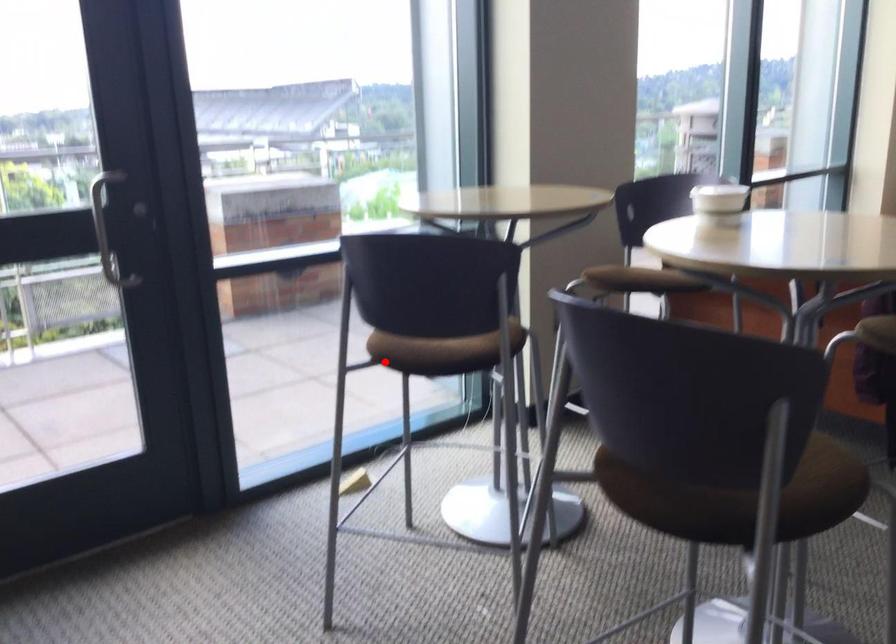
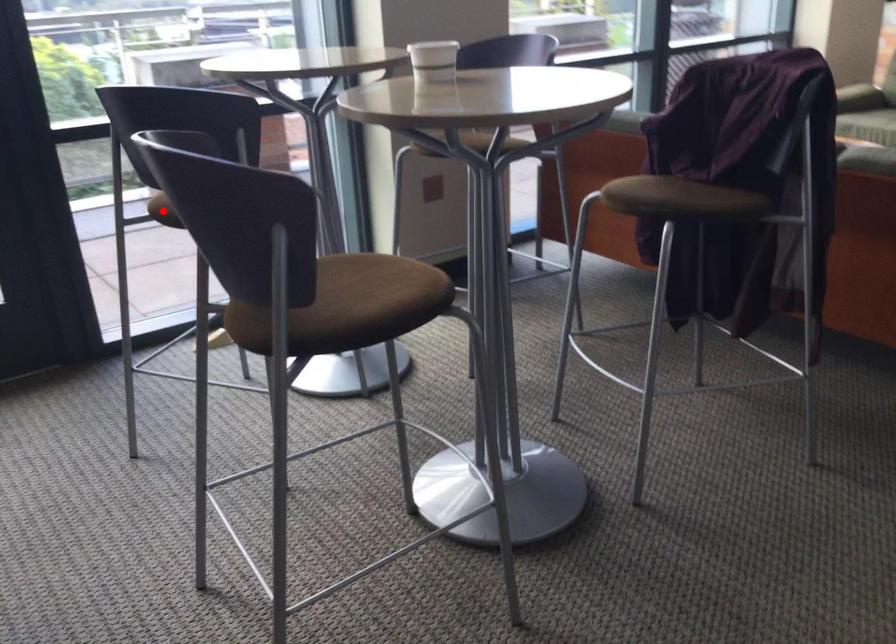
I am providing you with two images of the same scene from different viewpoints. A red point is marked on the first image and another point is marked on the second image. Is the marked point in image1 the same physical position as the marked point in image2?

Yes